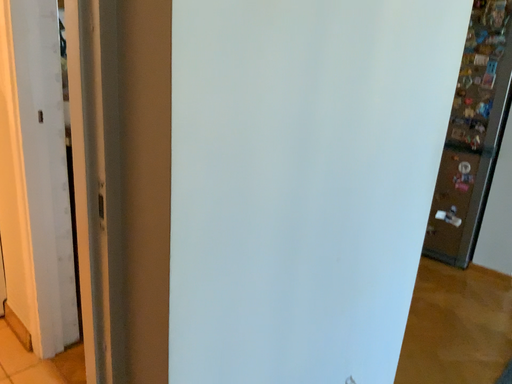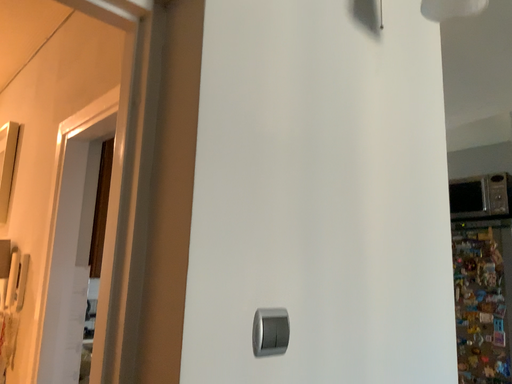
Question: Which way did the camera rotate in the video?

Choices:
 (A) rotated downward
 (B) rotated upward

Answer: (B)